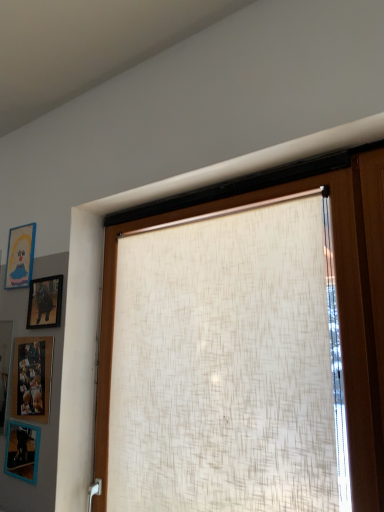
Question: From the image's perspective, is beige textured roller blind at center on top of wooden picture frame at lower left, which is the second picture frame from bottom to top?

Choices:
 (A) yes
 (B) no

Answer: (A)

Question: Is beige textured roller blind at center positioned beyond the bounds of wooden picture frame at lower left, which is the second picture frame from bottom to top?

Choices:
 (A) yes
 (B) no

Answer: (A)

Question: From the image's perspective, is beige textured roller blind at center under wooden picture frame at lower left, placed as the third picture frame when sorted from top to bottom?

Choices:
 (A) yes
 (B) no

Answer: (B)

Question: Could you tell me if beige textured roller blind at center is facing wooden picture frame at lower left, placed as the third picture frame when sorted from top to bottom?

Choices:
 (A) yes
 (B) no

Answer: (B)

Question: Considering the relative sizes of beige textured roller blind at center and wooden picture frame at lower left, which is the second picture frame from bottom to top, in the image provided, is beige textured roller blind at center shorter than wooden picture frame at lower left, which is the second picture frame from bottom to top,?

Choices:
 (A) no
 (B) yes

Answer: (A)

Question: Is blue plastic picture frame at lower left, acting as the 1th picture frame starting from the bottom, situated inside beige textured roller blind at center or outside?

Choices:
 (A) outside
 (B) inside

Answer: (A)

Question: Relative to beige textured roller blind at center, is blue plastic picture frame at lower left, acting as the 1th picture frame starting from the bottom, in front or behind?

Choices:
 (A) behind
 (B) front

Answer: (A)

Question: Considering the relative positions of blue plastic picture frame at lower left, acting as the 1th picture frame starting from the bottom, and beige textured roller blind at center in the image provided, is blue plastic picture frame at lower left, acting as the 1th picture frame starting from the bottom, to the left or to the right of beige textured roller blind at center?

Choices:
 (A) right
 (B) left

Answer: (B)

Question: From their relative heights in the image, would you say blue plastic picture frame at lower left, which ranks as the 4th picture frame in top-to-bottom order, is taller or shorter than beige textured roller blind at center?

Choices:
 (A) tall
 (B) short

Answer: (B)

Question: From a real-world perspective, is blue matte picture frame at upper left, marked as the 4th picture frame in a bottom-to-top arrangement, above or below matte black picture frame at upper left, the third picture frame from the bottom?

Choices:
 (A) below
 (B) above

Answer: (B)

Question: Choose the correct answer: Is blue matte picture frame at upper left, marked as the 4th picture frame in a bottom-to-top arrangement, inside matte black picture frame at upper left, the 2th picture frame positioned from the top, or outside it?

Choices:
 (A) outside
 (B) inside

Answer: (A)

Question: Looking at the image, does blue matte picture frame at upper left, which is the 1th picture frame in top-to-bottom order, seem bigger or smaller compared to matte black picture frame at upper left, the 2th picture frame positioned from the top?

Choices:
 (A) small
 (B) big

Answer: (A)

Question: In terms of height, does blue matte picture frame at upper left, which is the 1th picture frame in top-to-bottom order, look taller or shorter compared to matte black picture frame at upper left, the 2th picture frame positioned from the top?

Choices:
 (A) short
 (B) tall

Answer: (B)

Question: Considering the positions of point (24, 281) and point (97, 377), is point (24, 281) closer or farther from the camera than point (97, 377)?

Choices:
 (A) closer
 (B) farther

Answer: (B)

Question: Is blue matte picture frame at upper left, which is the 1th picture frame in top-to-bottom order, situated inside beige textured roller blind at center or outside?

Choices:
 (A) inside
 (B) outside

Answer: (B)